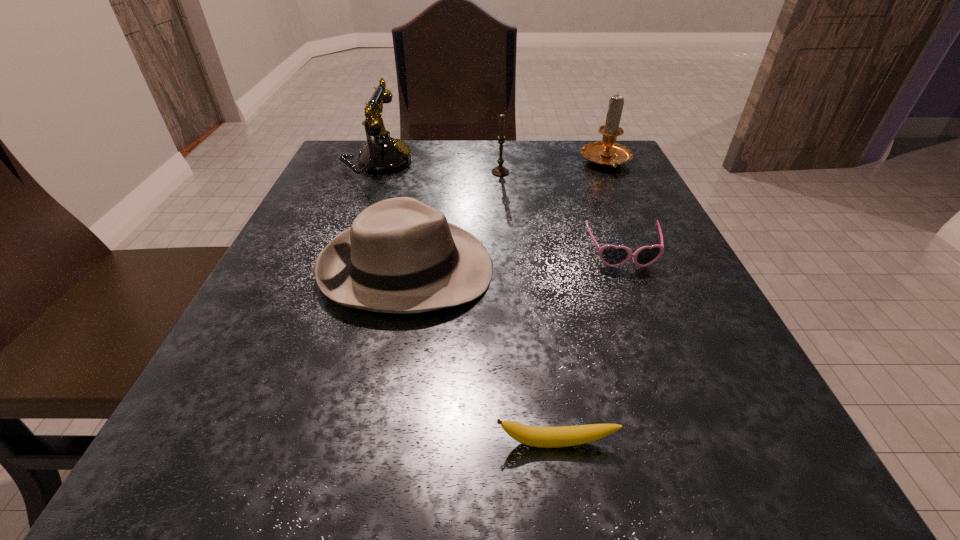
Find the location of a particular element. This screenshot has width=960, height=540. vacant space that satisfies the following two spatial constraints: 1. on the back side of the right candle; 2. on the dial of the telephone is located at coordinates (607, 163).

Identify the location of vacant point that satisfies the following two spatial constraints: 1. on the front side of the taller candle; 2. on the front-facing side of the fedora. (656, 269).